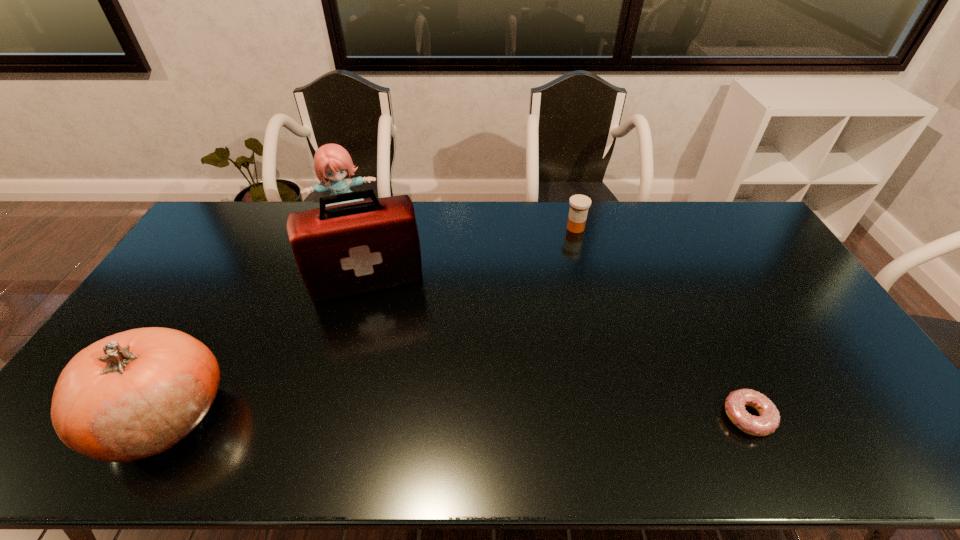
The height and width of the screenshot is (540, 960). What are the coordinates of `free spot on the desktop that is between the pumpkin and the rightmost object and is positioned on the label of the second shortest object` in the screenshot? It's located at (524, 416).

Locate an element on the screen. free spot on the desktop that is between the pumpkin and the rightmost object and is positioned on the side of the first aid kit with the cross symbol is located at coordinates (391, 416).

You are a GUI agent. You are given a task and a screenshot of the screen. Output one action in this format:
    pyautogui.click(x=<x>, y=<y>)
    Task: Click on the vacant space on the desktop that is between the pumpkin and the rightmost object and is positioned on the front-facing side of the doll
    This screenshot has width=960, height=540.
    Given the screenshot: What is the action you would take?
    pyautogui.click(x=393, y=416)